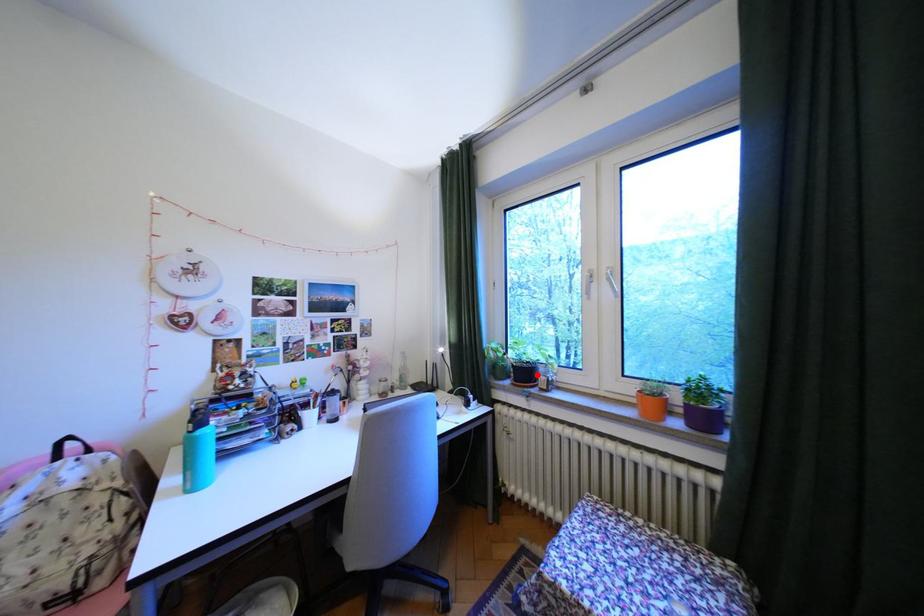
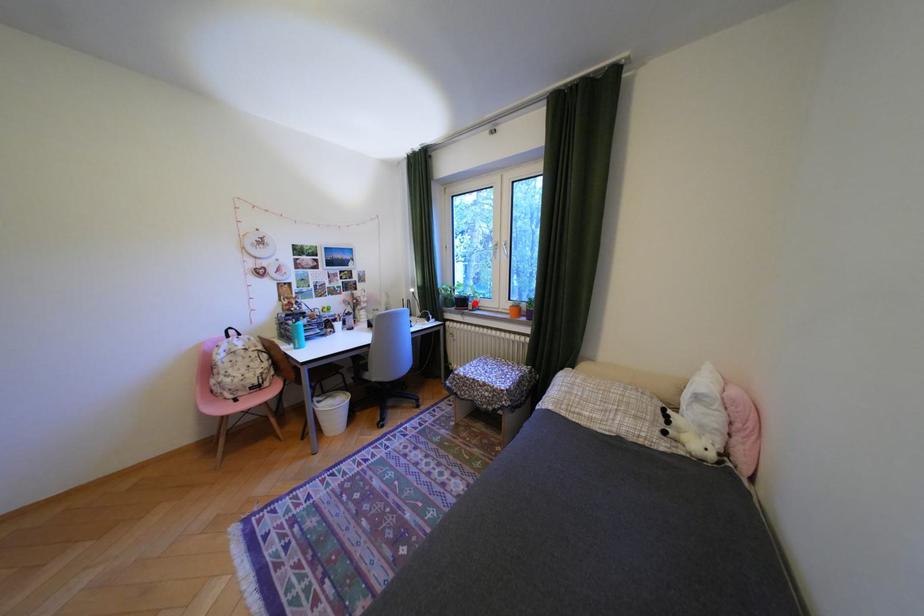
I am providing you with two images of the same scene from different viewpoints. A red point is marked on the first image and another point is marked on the second image. Does the point marked in image1 correspond to the same location as the one in image2?

Yes